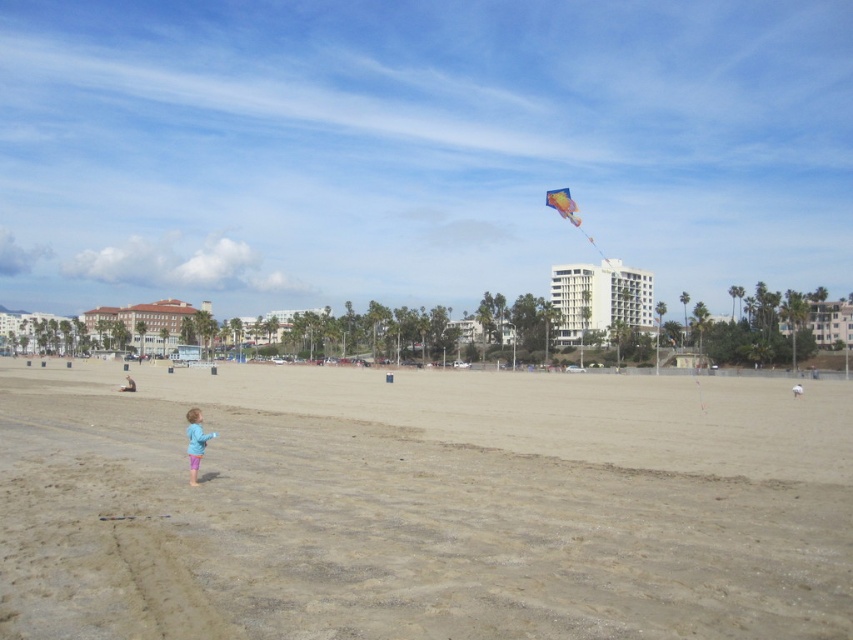
Question: Considering the real-world distances, which object is farthest from the white concrete building at center?

Choices:
 (A) multicolored fabric kite at upper center
 (B) blue fabric person at lower left

Answer: (B)

Question: Which point is farther to the camera?

Choices:
 (A) white concrete building at center
 (B) white cotton shirt at center
 (C) smooth sand beach at lower center
 (D) blue fabric person at lower left

Answer: (A)

Question: Where is blue fabric person at lower left located in relation to white cotton shirt at center in the image?

Choices:
 (A) left
 (B) right

Answer: (A)

Question: Does blue fabric person at lower left have a smaller size compared to white cotton shirt at center?

Choices:
 (A) no
 (B) yes

Answer: (A)

Question: Can you confirm if smooth sand beach at lower center is positioned above white cotton shirt at center?

Choices:
 (A) yes
 (B) no

Answer: (A)

Question: Among these objects, which one is nearest to the camera?

Choices:
 (A) blue fabric person at lower left
 (B) smooth sand beach at lower center
 (C) white cotton shirt at center

Answer: (B)